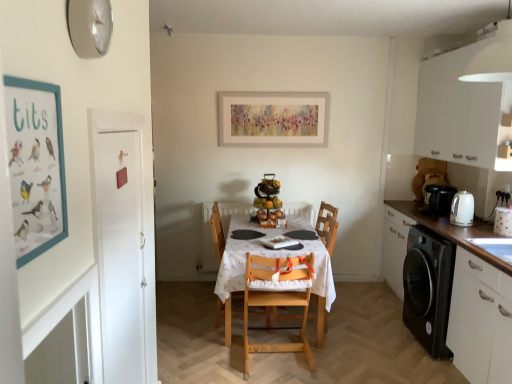
You are a GUI agent. You are given a task and a screenshot of the screen. Output one action in this format:
    pyautogui.click(x=<x>, y=<y>)
    Task: Click on the vacant space to the right of white wood table at center
    
    Given the screenshot: What is the action you would take?
    pyautogui.click(x=370, y=322)